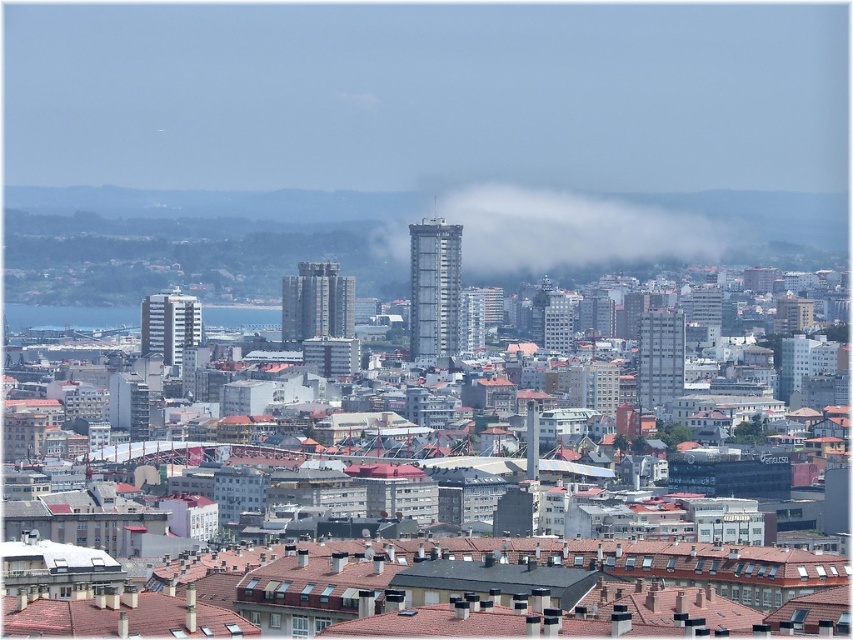
You are a photographer planning to capture the entire cityscape in one shot. Given that the white misty cloud at center and the blue water at center are both in the frame, which object would occupy more of the visual space in your photograph?

The white misty cloud at center is bigger than the blue water at center, so it would occupy more visual space in the photograph.

You are standing at the point with coordinates point (508, 218) and want to walk to the point (204, 321). According to the cityscape scene, will you be moving towards the foreground or the background?

Point (508, 218) is in front of point (204, 321). Therefore, moving from point (508, 218) to point (204, 321) means you are moving towards the background.